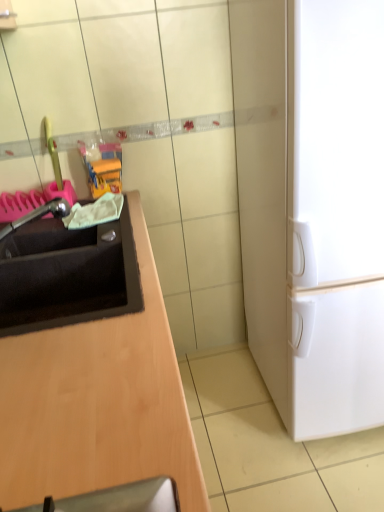
You are a GUI agent. You are given a task and a screenshot of the screen. Output one action in this format:
    pyautogui.click(x=<x>, y=<y>)
    Task: Click on the vacant space to the right of satin nickel faucet at left
    This screenshot has width=384, height=512.
    Given the screenshot: What is the action you would take?
    pyautogui.click(x=98, y=234)